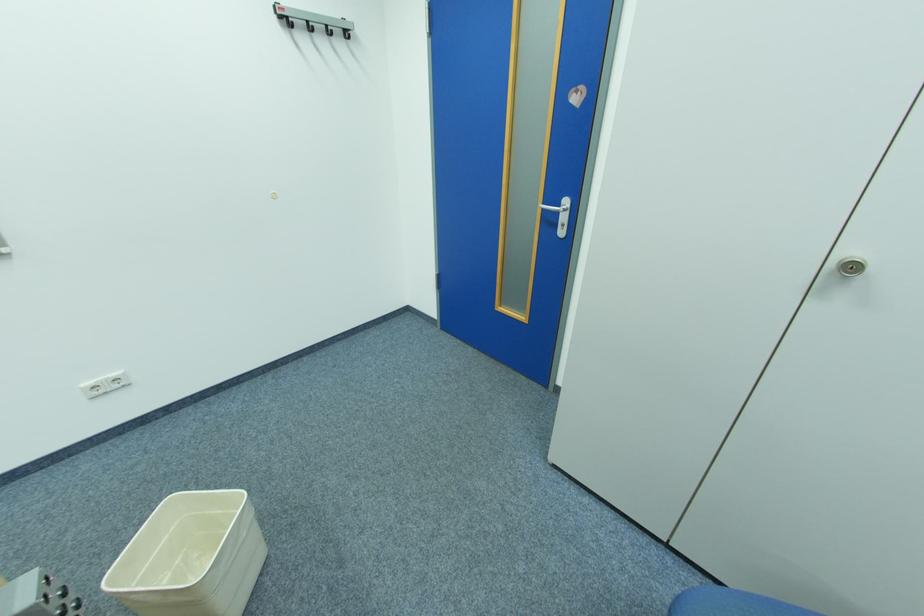
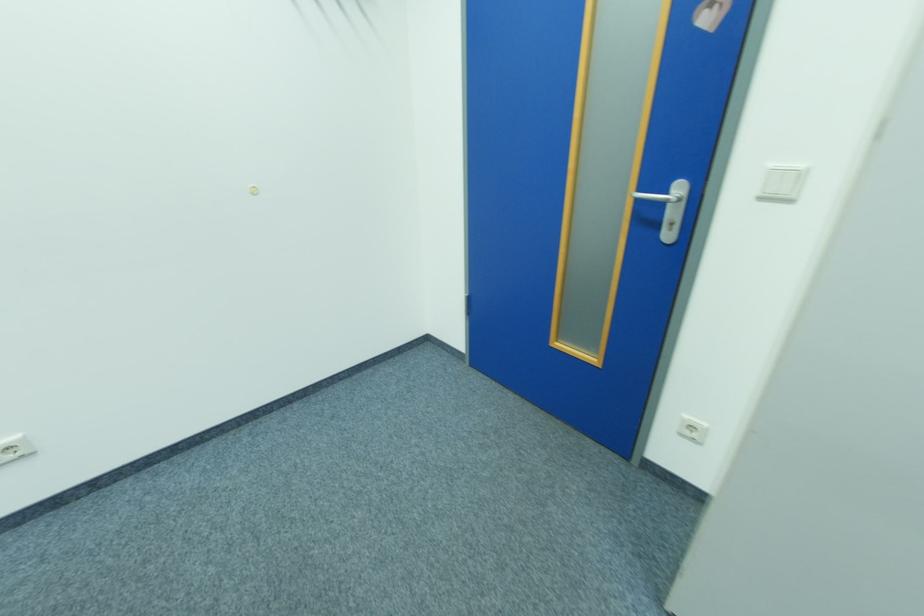
In the second image, find the point that corresponds to the point at 566,205 in the first image.

(677, 195)